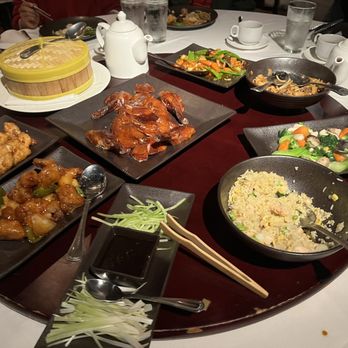
Where is `basket`? The image size is (348, 348). basket is located at coordinates (49, 74).